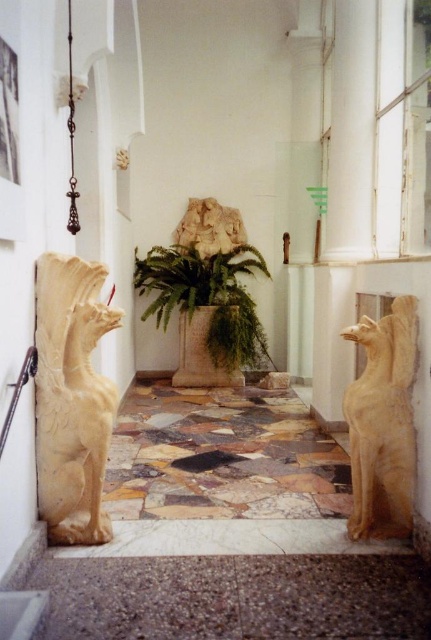
Consider the image. You are standing in the corridor of a museum and want to take a photo of the two points marked in the scene. Which point, point (80,353) or point (389,346), will appear larger in your camera view?

Point (80,353) will appear larger in the camera view because it is closer to the camera than point (389,346).

From the picture: You are standing in the corridor and want to walk towards the white marble lion at center. Is the green leafy fern at center blocking your path?

The green leafy fern at center is in front of the white marble lion at center, so it is blocking the path to the lion.